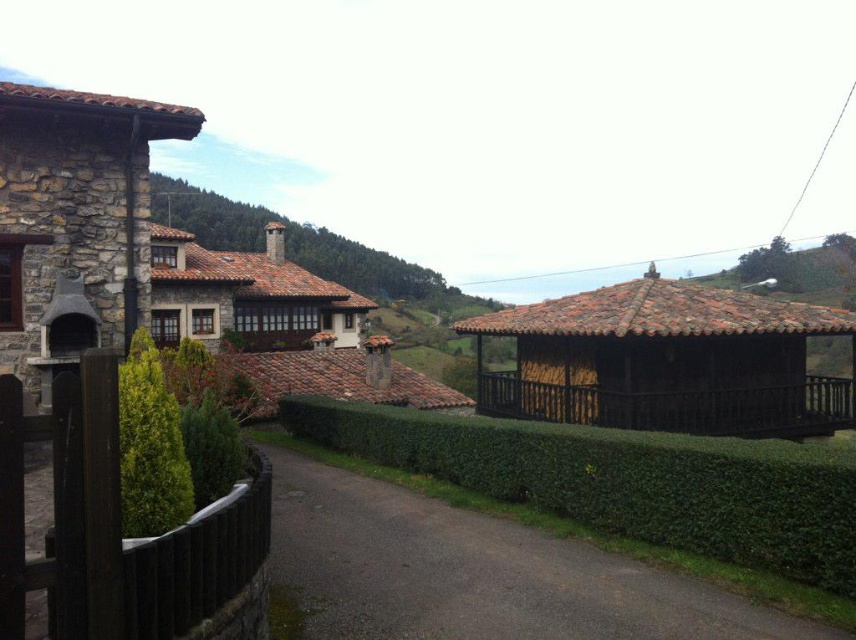
Question: Is green leafy hedge at center wider than brown wooden hut at center right?

Choices:
 (A) no
 (B) yes

Answer: (A)

Question: Among these objects, which one is farthest from the camera?

Choices:
 (A) brown wooden hut at center right
 (B) green leafy hedge at center
 (C) brown tiled roof at center

Answer: (C)

Question: Where is green leafy hedge at center located in relation to brown tiled roof at center in the image?

Choices:
 (A) below
 (B) above

Answer: (A)

Question: Is stone chimney at left behind brown tiled roof at center?

Choices:
 (A) no
 (B) yes

Answer: (A)

Question: Which point is closer to the camera taking this photo?

Choices:
 (A) (165, 339)
 (B) (712, 509)
 (C) (340, 346)

Answer: (B)

Question: Estimate the real-world distances between objects in this image. Which object is closer to the brown tiled roof at center?

Choices:
 (A) green leafy hedge at center
 (B) brown wooden hut at center right

Answer: (B)